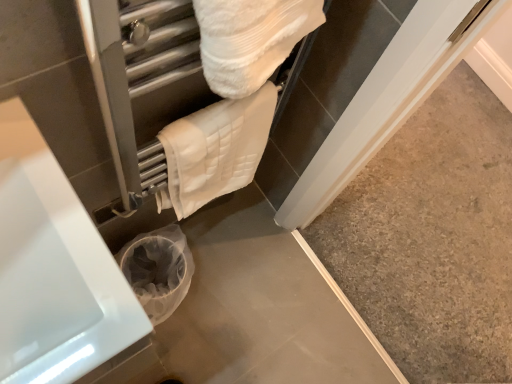
Question: From a real-world perspective, is white quilted towel at upper center above or below white glossy bathtub at lower left?

Choices:
 (A) above
 (B) below

Answer: (A)

Question: Looking at the image, does white quilted towel at upper center seem bigger or smaller compared to white glossy bathtub at lower left?

Choices:
 (A) big
 (B) small

Answer: (B)

Question: Does point (237, 100) appear closer or farther from the camera than point (51, 215)?

Choices:
 (A) closer
 (B) farther

Answer: (B)

Question: In terms of height, does white glossy bathtub at lower left look taller or shorter compared to white quilted towel at upper center?

Choices:
 (A) short
 (B) tall

Answer: (B)

Question: From a real-world perspective, relative to white quilted towel at upper center, is white glossy bathtub at lower left vertically above or below?

Choices:
 (A) below
 (B) above

Answer: (A)

Question: Considering their positions, is white glossy bathtub at lower left located in front of or behind white quilted towel at upper center?

Choices:
 (A) front
 (B) behind

Answer: (A)

Question: Is point (15, 380) positioned closer to the camera than point (263, 144)?

Choices:
 (A) farther
 (B) closer

Answer: (B)